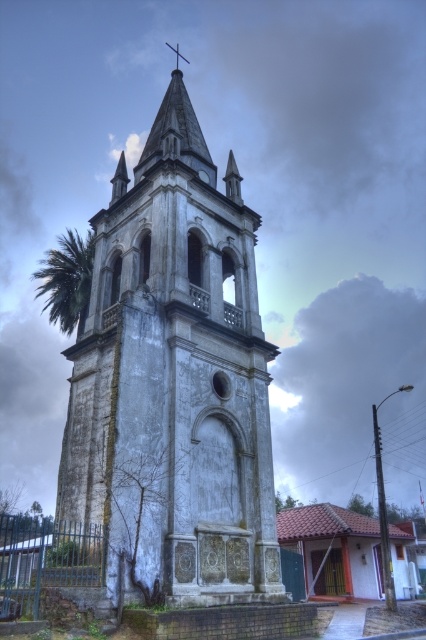
You are standing in a park and see the white stone tower at center and the green leafy palm at left. Which object appears taller in the image?

The green leafy palm at left appears taller than the white stone tower at center in the image.

You are standing in front of the bell tower and want to take a photo of the decorative stone plaque at the base. Where should you position yourself relative to the point marked at coordinates point [175,381]? Please answer with either left, right, front, or behind.

The point [175,381] indicates the white stone tower at center, so to photograph the decorative stone plaque at the base, you should position yourself in front of the point marked at coordinates point [175,381].

Based on the photo, you are standing in front of the bell tower and notice the green leafy palm at left and the metallic cross at upper center. Which object is positioned to the left of the other?

The green leafy palm at left is to the left of the metallic cross at upper center.